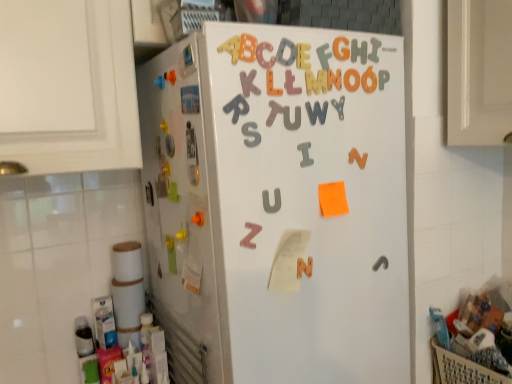
What are the coordinates of `plastic beige basket at lower right` in the screenshot? It's located at (460, 369).

In the scene shown: What is the approximate height of plastic beige basket at lower right?

It is 5.32 inches.

Locate an element on the screen. The width and height of the screenshot is (512, 384). gray magnetic letter u at upper center, which is the 8th letter from right to left is located at coordinates pos(294,118).

You are a GUI agent. You are given a task and a screenshot of the screen. Output one action in this format:
    pyautogui.click(x=<x>, y=<y>)
    Task: Click on the gray matte letter w at upper center, the 6th letter when ordered from left to right
    The height and width of the screenshot is (384, 512).
    Given the screenshot: What is the action you would take?
    pyautogui.click(x=317, y=112)

Find the location of a particular element. Image resolution: width=512 pixels, height=384 pixels. pink matte letter z at center is located at coordinates (250, 235).

Identify the location of matte plastic letter t at center, which is the ninth letter from right to left. (273, 112).

From the picture: In terms of height, does plastic beige basket at lower right look taller or shorter compared to pink matte letter z at center?

In the image, plastic beige basket at lower right appears to be taller than pink matte letter z at center.

Where is `alphabet that appears in front of the plastic beige basket at lower right`? Image resolution: width=512 pixels, height=384 pixels. alphabet that appears in front of the plastic beige basket at lower right is located at coordinates (250, 235).

Does plastic beige basket at lower right appear on the left side of pink matte letter z at center?

In fact, plastic beige basket at lower right is to the right of pink matte letter z at center.

Between point (457, 364) and point (260, 228), which one is positioned in front?

Positioned in front is point (260, 228).

Which is behind, orange matte letter n at upper center, which is the 8th letter from left to right, or yellow foam letter e at upper center, which is the 4th letter from left to right?

orange matte letter n at upper center, which is the 8th letter from left to right, is more distant.

Does orange matte letter n at upper center, the 2th letter positioned from the right, have a greater width compared to yellow foam letter e at upper center, which is the sixth letter from right to left?

Indeed, orange matte letter n at upper center, the 2th letter positioned from the right, has a greater width compared to yellow foam letter e at upper center, which is the sixth letter from right to left.

From a real-world perspective, between orange matte letter n at upper center, which is the 8th letter from left to right, and yellow foam letter e at upper center, which is the 4th letter from left to right, who is vertically lower?

From a 3D spatial view, orange matte letter n at upper center, which is the 8th letter from left to right, is below.

Measure the distance from orange matte letter n at upper center, which is the 8th letter from left to right, to yellow foam letter e at upper center, which is the 4th letter from left to right.

A distance of 7.70 centimeters exists between orange matte letter n at upper center, which is the 8th letter from left to right, and yellow foam letter e at upper center, which is the 4th letter from left to right.

Considering the points (287, 127) and (333, 80), which point is in front, point (287, 127) or point (333, 80)?

Point (287, 127)

Would you say orange matte letter n at upper center, which is the 8th letter from left to right, is part of gray magnetic letter u at upper center, which is the 8th letter from right to left,'s contents?

No, orange matte letter n at upper center, which is the 8th letter from left to right, is not surrounded by gray magnetic letter u at upper center, which is the 8th letter from right to left.

From the image's perspective, which one is positioned higher, gray magnetic letter u at upper center, the 2th letter viewed from the left, or orange matte letter n at upper center, which is the 8th letter from left to right?

orange matte letter n at upper center, which is the 8th letter from left to right, from the image's perspective.

Considering the positions of objects gray matte letter w at upper center, the 6th letter when ordered from left to right, and orange matte letter at upper center, which is counted as the 5th letter, starting from the right, in the image provided, who is in front, gray matte letter w at upper center, the 6th letter when ordered from left to right, or orange matte letter at upper center, which is counted as the 5th letter, starting from the right,?

orange matte letter at upper center, which is counted as the 5th letter, starting from the right, is closer to the camera.

Is point (308, 116) in front of point (319, 91)?

Yes, it is.

From the image's perspective, which object appears higher, gray matte letter w at upper center, the 6th letter when ordered from left to right, or orange matte letter at upper center, which appears as the 5th letter when viewed from the left?

orange matte letter at upper center, which appears as the 5th letter when viewed from the left, appears higher in the image.

Can you confirm if gray matte letter w at upper center, which is the 4th letter in right-to-left order, is taller than orange matte letter at upper center, which appears as the 5th letter when viewed from the left?

No, gray matte letter w at upper center, which is the 4th letter in right-to-left order, is not taller than orange matte letter at upper center, which appears as the 5th letter when viewed from the left.

Which letter is the 1st one when counting from the right side of the pink matte letter z at center? Please provide its 2D coordinates.

[(273, 112)]

Considering the relative sizes of matte plastic letter t at center, the 1th letter in the left-to-right sequence, and pink matte letter z at center in the image provided, is matte plastic letter t at center, the 1th letter in the left-to-right sequence, smaller than pink matte letter z at center?

Indeed, matte plastic letter t at center, the 1th letter in the left-to-right sequence, has a smaller size compared to pink matte letter z at center.

Is point (277, 110) positioned before point (250, 232)?

No, (277, 110) is behind (250, 232).

Which of these two, pink matte letter z at center or yellow foam letter e at upper center, which is the 4th letter from left to right, is bigger?

pink matte letter z at center.

Does pink matte letter z at center have a lesser height compared to yellow foam letter e at upper center, which is the 4th letter from left to right?

In fact, pink matte letter z at center may be taller than yellow foam letter e at upper center, which is the 4th letter from left to right.

In the scene shown: Could yellow foam letter e at upper center, which is the sixth letter from right to left, be considered to be inside pink matte letter z at center?

No.

Considering the sizes of objects pink matte letter z at center and yellow foam letter e at upper center, which is the sixth letter from right to left, in the image provided, who is thinner, pink matte letter z at center or yellow foam letter e at upper center, which is the sixth letter from right to left,?

With smaller width is yellow foam letter e at upper center, which is the sixth letter from right to left.

Is orange matte letter n at upper center, the 2th letter positioned from the right, in contact with matte plastic letter t at center, which is the ninth letter from right to left?

No.

Is orange matte letter n at upper center, the 2th letter positioned from the right, facing away from matte plastic letter t at center, which is the ninth letter from right to left?

No, orange matte letter n at upper center, the 2th letter positioned from the right, is not facing the opposite direction of matte plastic letter t at center, which is the ninth letter from right to left.

How far apart are orange matte letter n at upper center, the 2th letter positioned from the right, and matte plastic letter t at center, the 1th letter in the left-to-right sequence?

orange matte letter n at upper center, the 2th letter positioned from the right, and matte plastic letter t at center, the 1th letter in the left-to-right sequence, are 15.64 centimeters apart.

Considering the relative sizes of orange matte letter n at upper center, the 2th letter positioned from the right, and matte plastic letter t at center, which is the ninth letter from right to left, in the image provided, is orange matte letter n at upper center, the 2th letter positioned from the right, bigger than matte plastic letter t at center, which is the ninth letter from right to left,?

Actually, orange matte letter n at upper center, the 2th letter positioned from the right, might be smaller than matte plastic letter t at center, which is the ninth letter from right to left.

Image resolution: width=512 pixels, height=384 pixels. I want to click on alphabet located above the plastic beige basket at lower right (from the image's perspective), so click(x=250, y=235).

Where is `the 2nd letter above the orange matte letter n at upper center, which is the 8th letter from left to right (from a real-world perspective)`? Image resolution: width=512 pixels, height=384 pixels. the 2nd letter above the orange matte letter n at upper center, which is the 8th letter from left to right (from a real-world perspective) is located at coordinates (303, 56).

Which object lies nearer to the anchor point matte plastic letter at upper center, the seventh letter in the right-to-left sequence, matte plastic letter t at center, the 1th letter in the left-to-right sequence, or orange matte letter at upper center, which is counted as the 5th letter, starting from the right?

orange matte letter at upper center, which is counted as the 5th letter, starting from the right, is closer to matte plastic letter at upper center, the seventh letter in the right-to-left sequence.

When comparing their distances from matte plastic letter t at center, the 1th letter in the left-to-right sequence, does rubberized plastic letter f at upper center, placed as the 3th letter when sorted from right to left, or pink matte letter z at center seem closer?

rubberized plastic letter f at upper center, placed as the 3th letter when sorted from right to left, lies closer to matte plastic letter t at center, the 1th letter in the left-to-right sequence, than the other object.

Considering their positions, is rubberized plastic letter f at upper center, placed as the 3th letter when sorted from right to left, positioned closer to orange matte letter n at upper center, which is the 8th letter from left to right, than white matte refrigerator at center?

Among the two, rubberized plastic letter f at upper center, placed as the 3th letter when sorted from right to left, is located nearer to orange matte letter n at upper center, which is the 8th letter from left to right.

Estimate the real-world distances between objects in this image. Which object is closer to white matte refrigerator at center, gray matte letter w at upper center, the 6th letter when ordered from left to right, or plastic beige basket at lower right?

gray matte letter w at upper center, the 6th letter when ordered from left to right, is positioned closer to the anchor white matte refrigerator at center.

Looking at the image, which one is located closer to orange matte letter n at upper center, which is the 8th letter from left to right, yellow foam letter e at upper center, which is the 4th letter from left to right, or gray rubber letter y at upper center, acting as the 9th letter starting from the left?

The object closer to orange matte letter n at upper center, which is the 8th letter from left to right, is gray rubber letter y at upper center, acting as the 9th letter starting from the left.

Estimate the real-world distances between objects in this image. Which object is further from gray rubber letter y at upper center, the 1th letter when ordered from right to left, white matte refrigerator at center or orange matte letter at upper center, which is counted as the 5th letter, starting from the right?

white matte refrigerator at center.

Based on the photo, which object lies further to the anchor point gray magnetic letter u at upper center, the 2th letter viewed from the left, gray rubber letter y at upper center, acting as the 9th letter starting from the left, or orange matte letter at upper center, which is counted as the 5th letter, starting from the right?

gray rubber letter y at upper center, acting as the 9th letter starting from the left, is further to gray magnetic letter u at upper center, the 2th letter viewed from the left.

Which object lies nearer to the anchor point matte plastic letter at upper center, the seventh letter in the right-to-left sequence, white glossy refrigerator at left or gray matte letter w at upper center, which is the 4th letter in right-to-left order?

The object closer to matte plastic letter at upper center, the seventh letter in the right-to-left sequence, is gray matte letter w at upper center, which is the 4th letter in right-to-left order.

Locate an element on the screen. refrigerator between pink matte letter z at center and plastic beige basket at lower right is located at coordinates (277, 208).

This screenshot has height=384, width=512. I want to click on refrigerator that lies between rubberized plastic letter f at upper center, placed as the 7th letter when sorted from left to right, and plastic beige basket at lower right from top to bottom, so click(277, 208).

You are a GUI agent. You are given a task and a screenshot of the screen. Output one action in this format:
    pyautogui.click(x=<x>, y=<y>)
    Task: Click on the alphabet that lies between rubberized plastic letter f at upper center, placed as the 7th letter when sorted from left to right, and white matte refrigerator at center from top to bottom
    This screenshot has height=384, width=512.
    Given the screenshot: What is the action you would take?
    click(x=250, y=235)

Find the location of a particular element. This screenshot has width=512, height=384. alphabet between white glossy refrigerator at left and gray magnetic letter u at upper center, the 2th letter viewed from the left, from left to right is located at coordinates (250, 235).